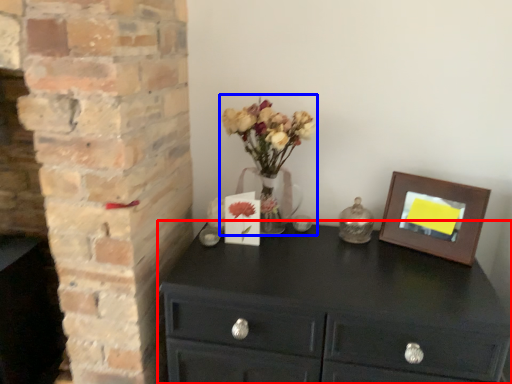
Question: Which object appears closest to the camera in this image, chest of drawers (highlighted by a red box) or floral arrangement (highlighted by a blue box)?

Choices:
 (A) chest of drawers
 (B) floral arrangement

Answer: (A)